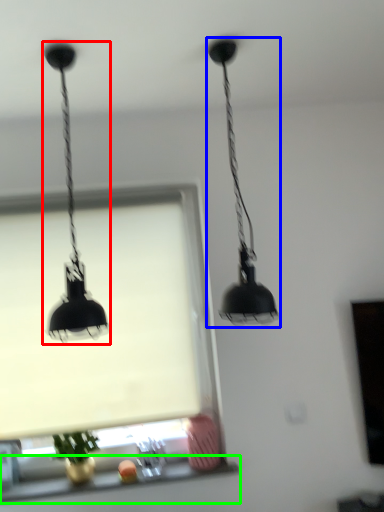
Question: Which object is the closest to the lamp (highlighted by a red box)? Choose among these: lamp (highlighted by a blue box) or window sill (highlighted by a green box).

Choices:
 (A) lamp
 (B) window sill

Answer: (A)